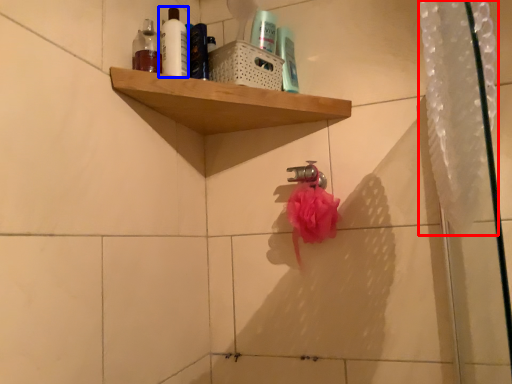
Question: Which of the following is the closest to the observer, shower curtain (highlighted by a red box) or mouthwash (highlighted by a blue box)?

Choices:
 (A) shower curtain
 (B) mouthwash

Answer: (A)